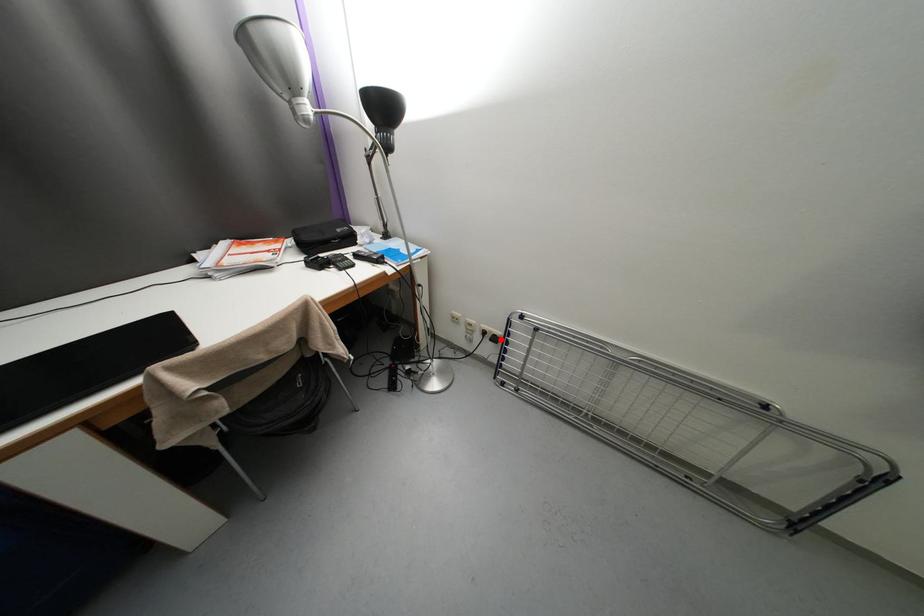
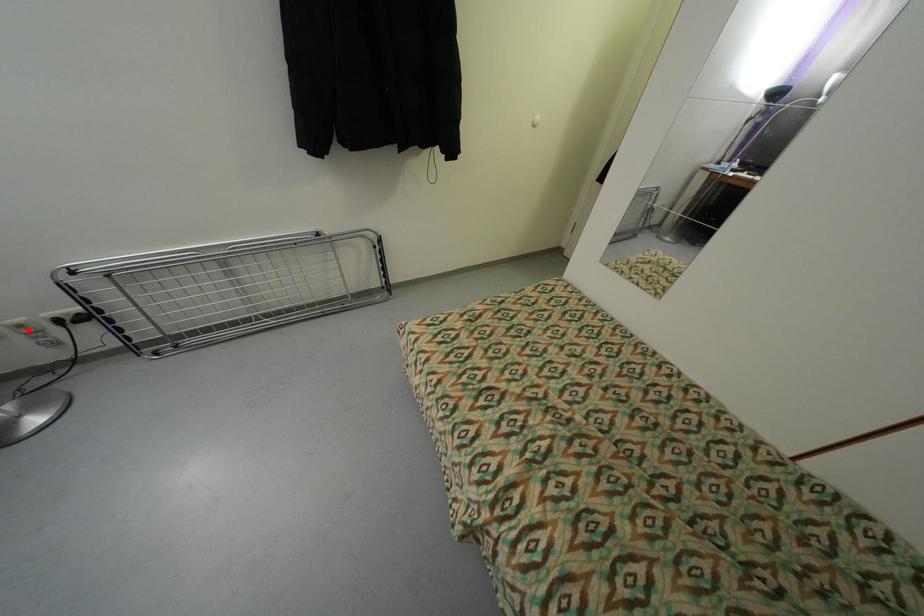
I am providing you with two images of the same scene from different viewpoints. A red point is marked on the first image and another point is marked on the second image. Are the points marked in image1 and image2 representing the same 3D position?

No